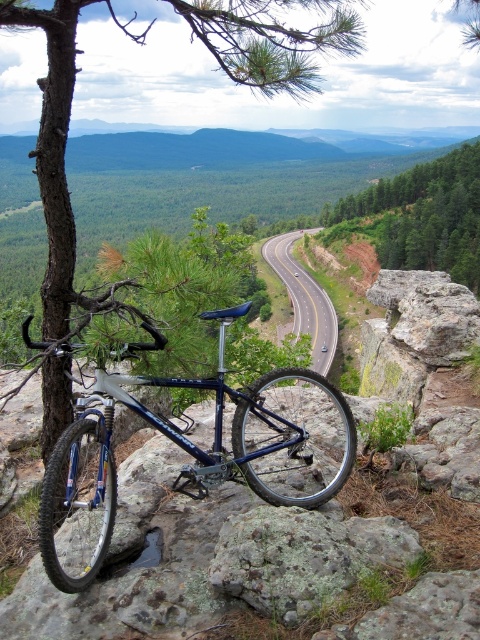
You are a photographer trying to capture both the shiny blue frame at center and the green leafy tree at center in a single shot. Based on their sizes, which object should you focus on first to ensure both fit in the frame?

The shiny blue frame at center is smaller than the green leafy tree at center, so you should focus on the green leafy tree at center first to ensure both fit in the frame.

You are an outdoor photographer planning to take a photo of the brown rough tree at upper left and the green mossy rock at center. Which object should you focus on first if you want to capture both in a single frame without adjusting your camera position?

The brown rough tree at upper left should be focused on first because it is taller than the green mossy rock at center, allowing you to ensure both are in frame by starting with the taller object.

You are a hiker who wants to take a photo of the asphalt road at center and the green leafy tree at center. Which object should you focus on first if you want both to be in focus?

The asphalt road at center is behind green leafy tree at center, so you should focus on the green leafy tree at center first to ensure both are in focus.